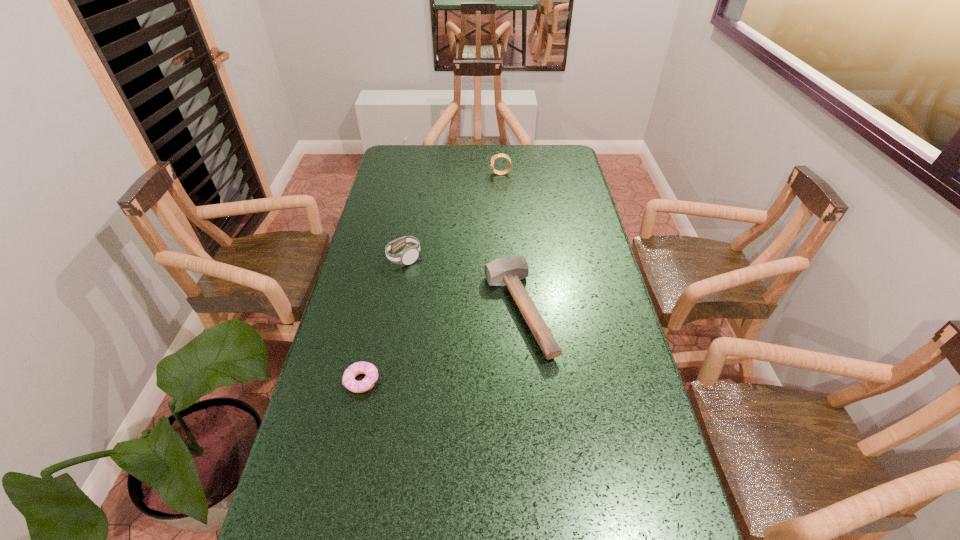
In order to click on vacant area located on the back of the third tallest object in this screenshot , I will do `click(511, 214)`.

The width and height of the screenshot is (960, 540). I want to click on free space located on the left of the shortest object, so click(x=322, y=381).

Identify the location of object that is positioned at the far edge. (487, 539).

The height and width of the screenshot is (540, 960). In order to click on watch that is at the left edge in this screenshot , I will do pyautogui.click(x=409, y=254).

Where is `doughnut at the left edge`? The image size is (960, 540). doughnut at the left edge is located at coordinates (348, 380).

Identify the location of object that can be found as the closest to the nearer watch. (509, 270).

I want to click on object that is the nearest to the mallet, so click(409, 254).

Locate an element on the screen. Image resolution: width=960 pixels, height=540 pixels. free space that satisfies the following two spatial constraints: 1. on the face of the nearer watch; 2. on the right side of the third tallest object is located at coordinates (395, 310).

At what (x,y) coordinates should I click in order to perform the action: click on vacant space that satisfies the following two spatial constraints: 1. on the face of the third tallest object; 2. on the right side of the farthest object. Please return your answer as a coordinate pair (x, y). Looking at the image, I should click on (510, 310).

Where is `vacant area that satisfies the following two spatial constraints: 1. on the face of the second shortest object; 2. on the right side of the right watch`? This screenshot has width=960, height=540. vacant area that satisfies the following two spatial constraints: 1. on the face of the second shortest object; 2. on the right side of the right watch is located at coordinates (510, 310).